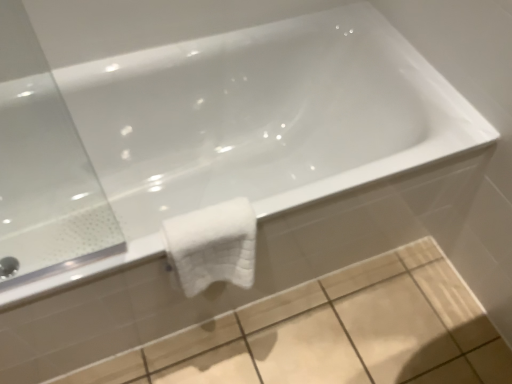
In order to face white soft towel at lower center, should I rotate leftwards or rightwards?

Rotate left and turn 5.066 degrees.

Where is `white soft towel at lower center`? This screenshot has height=384, width=512. white soft towel at lower center is located at coordinates (213, 245).

This screenshot has width=512, height=384. What do you see at coordinates (213, 245) in the screenshot?
I see `white soft towel at lower center` at bounding box center [213, 245].

Where is `white soft towel at lower center`? This screenshot has width=512, height=384. white soft towel at lower center is located at coordinates (213, 245).